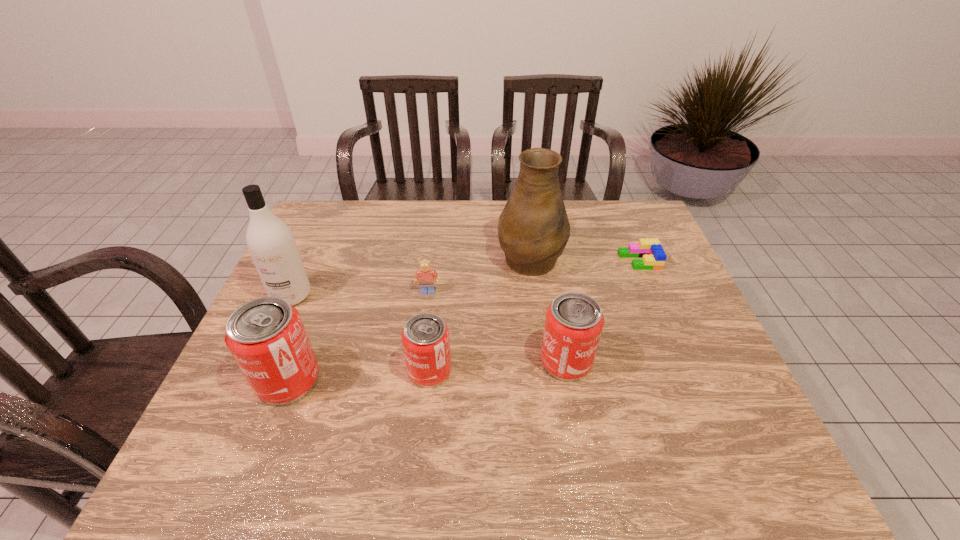
Image resolution: width=960 pixels, height=540 pixels. Find the location of `the farther Lego`. the farther Lego is located at coordinates (651, 251).

The height and width of the screenshot is (540, 960). What are the coordinates of `vacant space located 0.340m on the back of the leftmost can` in the screenshot? It's located at (332, 265).

I want to click on vacant area situated on the right of the second can from left to right, so click(473, 370).

At what (x,y) coordinates should I click in order to perform the action: click on vacant space situated on the back of the fourth shortest object. Please return your answer as a coordinate pair (x, y). The width and height of the screenshot is (960, 540). Looking at the image, I should click on (548, 260).

Locate an element on the screen. vacant area situated on the handle side of the pitcher is located at coordinates (523, 201).

This screenshot has height=540, width=960. What are the coordinates of `vacant space situated 0.180m on the handle side of the pitcher` in the screenshot? It's located at (523, 204).

The width and height of the screenshot is (960, 540). Identify the location of vacant region located 0.190m on the handle side of the pitcher. (523, 202).

Find the location of `free space located 0.240m on the front-facing side of the shampoo`. free space located 0.240m on the front-facing side of the shampoo is located at coordinates (251, 384).

This screenshot has width=960, height=540. Identify the location of free point located on the front-facing side of the taller Lego. (417, 382).

Locate an element on the screen. The height and width of the screenshot is (540, 960). free region located on the back of the shortest object is located at coordinates (622, 219).